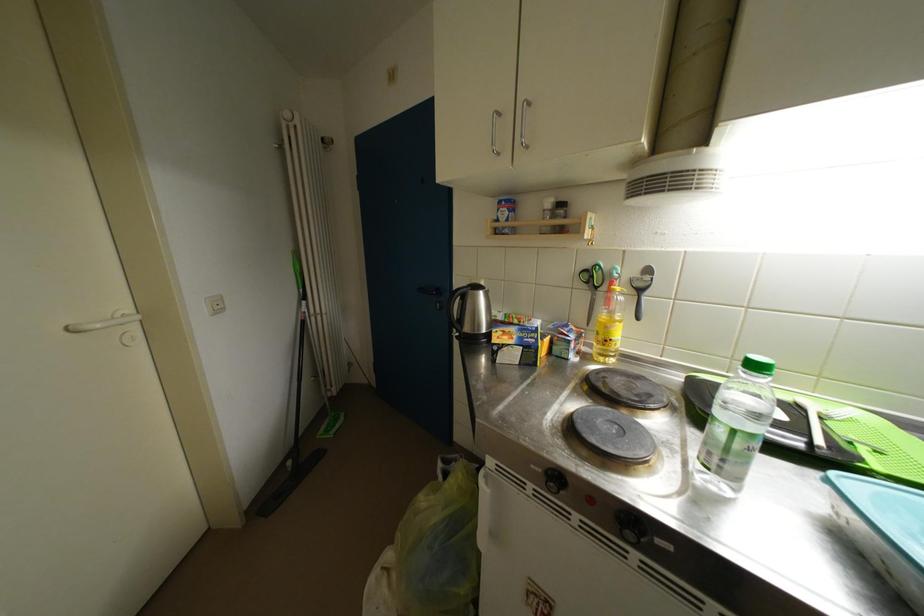
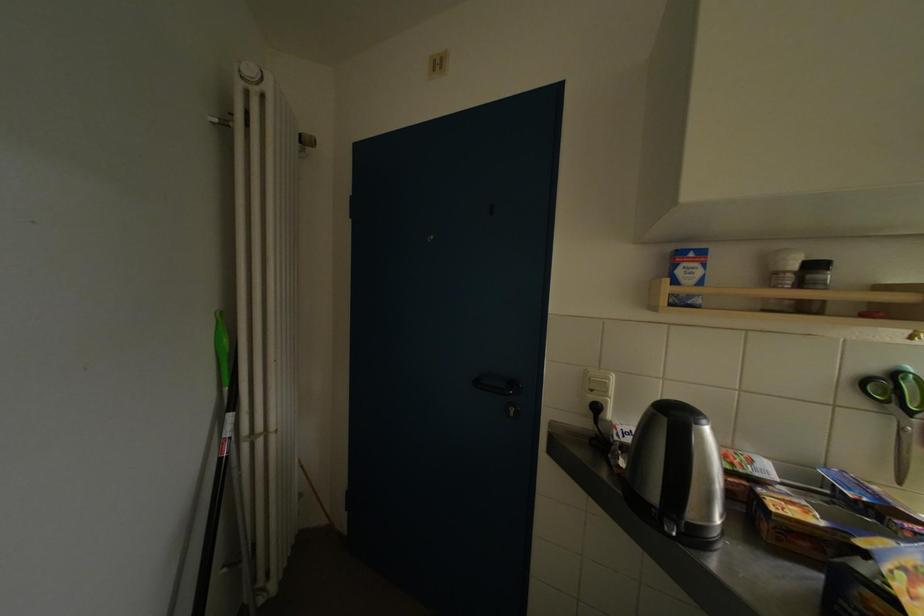
In the second image, find the point that corresponds to pixel 551 215 in the first image.

(784, 277)